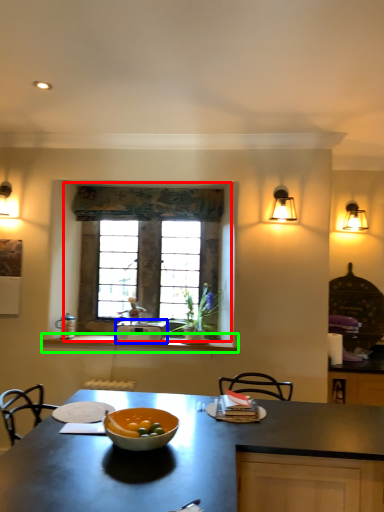
Question: Which object is positioned closest to window (highlighted by a red box)? Select from kitchen appliance (highlighted by a blue box) and counter (highlighted by a green box).

Choices:
 (A) kitchen appliance
 (B) counter

Answer: (A)